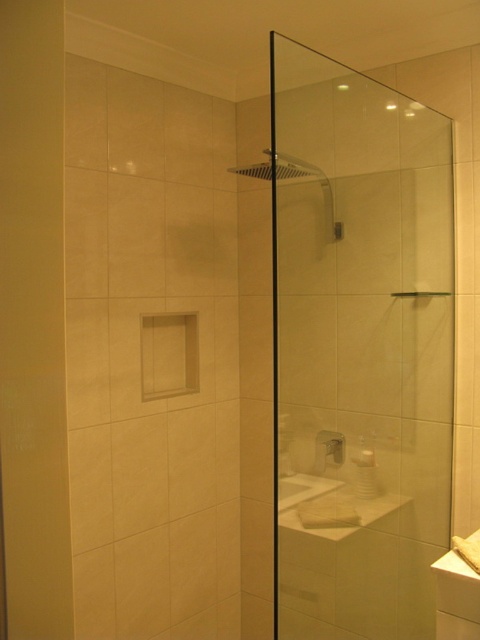
Question: Does transparent glass screen door at left appear under white glossy sink at lower right?

Choices:
 (A) no
 (B) yes

Answer: (A)

Question: Is transparent glass screen door at left further to camera compared to white glossy sink at lower right?

Choices:
 (A) yes
 (B) no

Answer: (B)

Question: Is transparent glass shower door at center thinner than white glossy sink at lower right?

Choices:
 (A) yes
 (B) no

Answer: (B)

Question: Which object is the farthest from the transparent glass screen door at left?

Choices:
 (A) transparent glass shower door at center
 (B) white glossy sink at lower right

Answer: (A)

Question: Estimate the real-world distances between objects in this image. Which object is farther from the transparent glass screen door at left?

Choices:
 (A) white glossy sink at lower right
 (B) transparent glass shower door at center

Answer: (B)

Question: Which point is farther to the camera?

Choices:
 (A) transparent glass screen door at left
 (B) transparent glass shower door at center
 (C) white glossy sink at lower right

Answer: (B)